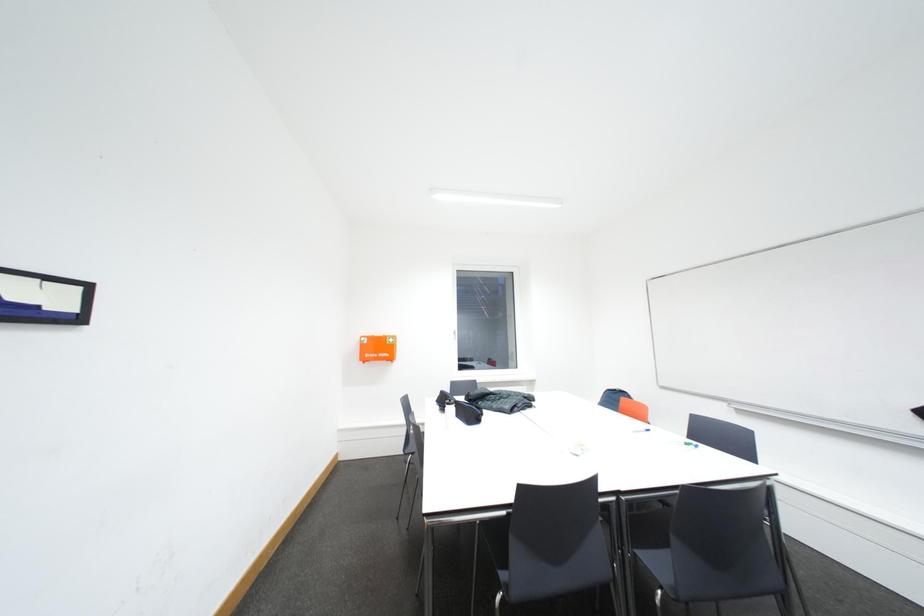
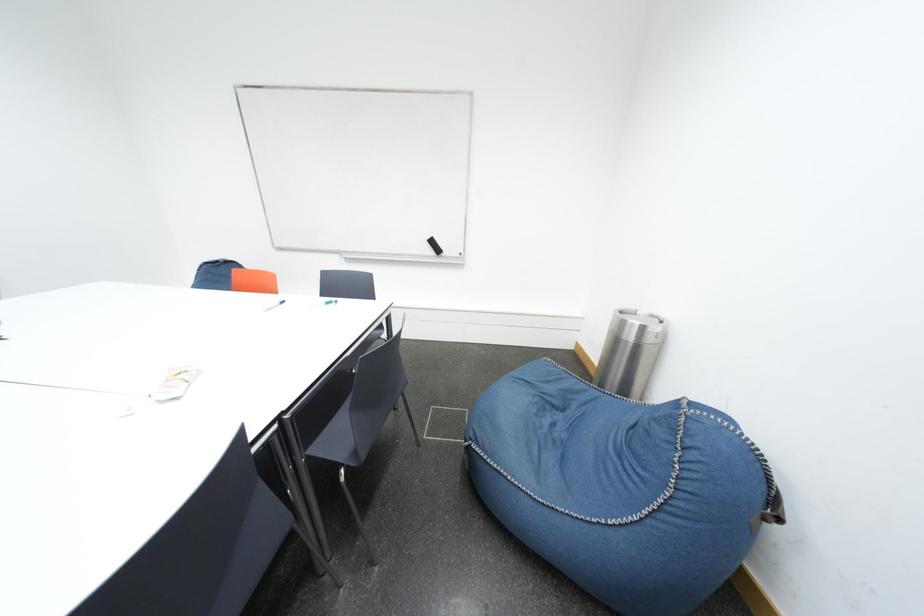
In the scene shown: How did the camera likely rotate?

The camera's rotation is toward right-down.